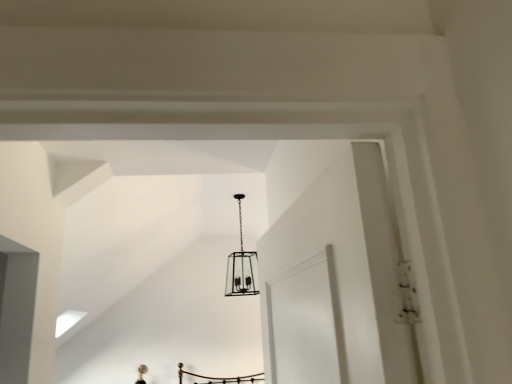
What is the approximate width of black metal cage at center?

black metal cage at center is 18.52 inches wide.

This screenshot has width=512, height=384. Describe the element at coordinates (241, 267) in the screenshot. I see `black metal cage at center` at that location.

Locate an element on the screen. This screenshot has height=384, width=512. black metal cage at center is located at coordinates (241, 267).

Identify the location of black metal cage at center. The image size is (512, 384). (241, 267).